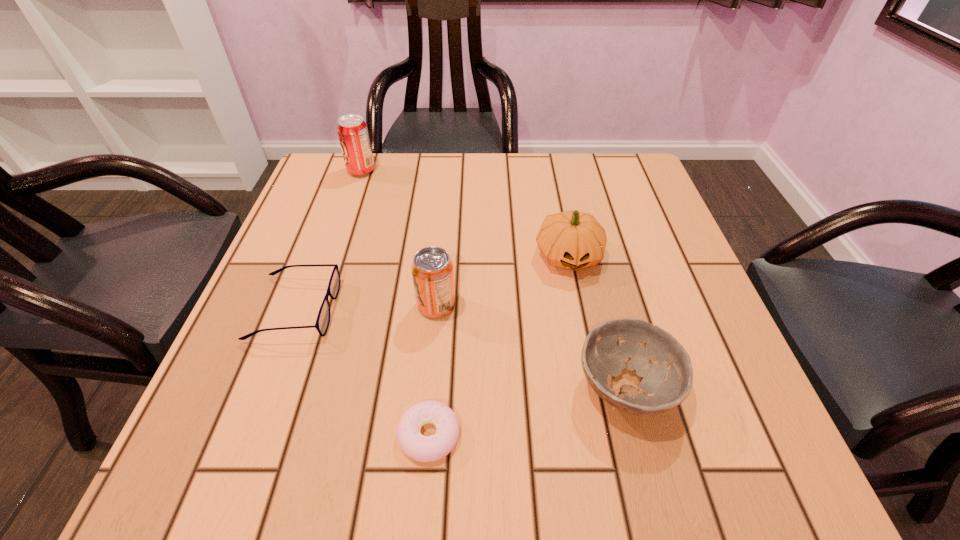
The height and width of the screenshot is (540, 960). Identify the location of the farthest object. (353, 134).

In order to click on the left soda can in this screenshot , I will do tap(353, 134).

Image resolution: width=960 pixels, height=540 pixels. What are the coordinates of `the nearer soda can` in the screenshot? It's located at (432, 269).

Find the location of a particular element. The height and width of the screenshot is (540, 960). gourd is located at coordinates (573, 240).

I want to click on the fourth tallest object, so click(667, 383).

This screenshot has height=540, width=960. What are the coordinates of `the second shortest object` in the screenshot? It's located at (323, 319).

Where is `doughnut`? doughnut is located at coordinates (421, 448).

Find the location of a particular element. vacant space located on the front of the farthest object is located at coordinates (347, 215).

Where is `vacant space located 0.170m on the back of the right soda can`? vacant space located 0.170m on the back of the right soda can is located at coordinates (443, 235).

Find the location of a particular element. The height and width of the screenshot is (540, 960). vacant space located on the side of the gourd with the carved face is located at coordinates (609, 455).